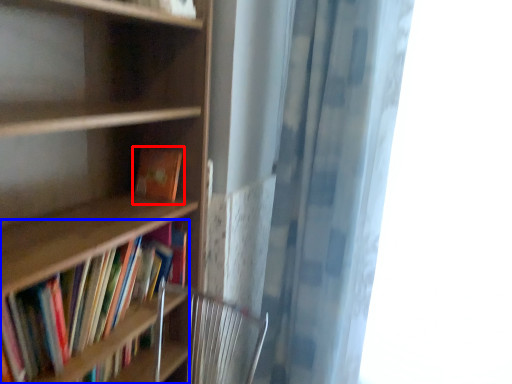
Question: Which object appears farthest to the camera in this image, book (highlighted by a red box) or book (highlighted by a blue box)?

Choices:
 (A) book
 (B) book

Answer: (A)